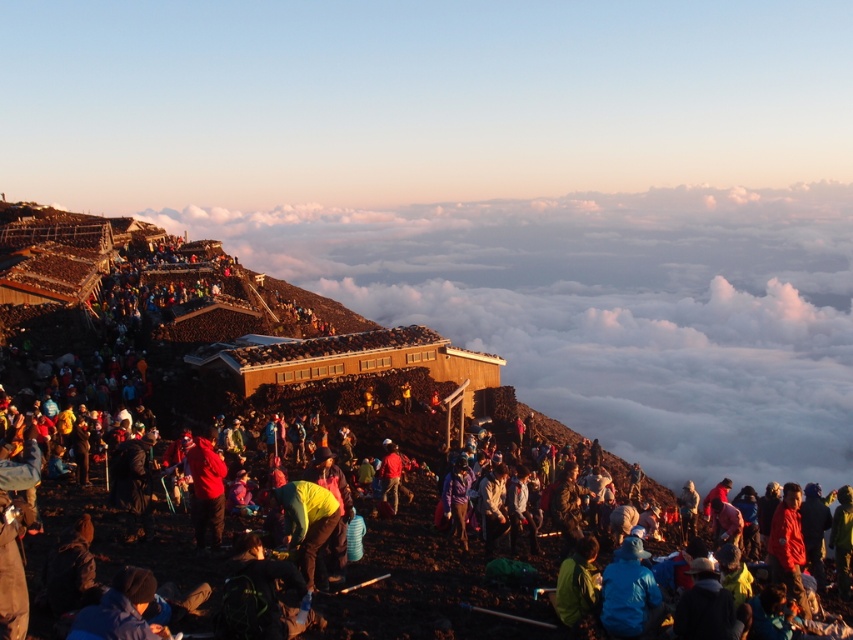
Who is lower down, yellow jacket at center or matte red jacket at center?

Positioned lower is matte red jacket at center.

Who is more distant from viewer, (241, 513) or (212, 464)?

The point (241, 513) is more distant.

Between point (166, 378) and point (192, 522), which one is positioned behind?

Point (166, 378)

At what (x,y) coordinates should I click in order to perform the action: click on yellow jacket at center. Please return your answer as a coordinate pair (x, y). Looking at the image, I should click on (251, 372).

Is yellow fabric at center wider than matte red jacket at center?

In fact, yellow fabric at center might be narrower than matte red jacket at center.

Does yellow fabric at center appear under matte red jacket at center?

Yes.

Locate an element on the screen. yellow fabric at center is located at coordinates (306, 522).

Is yellow jacket at center thinner than yellow fabric at center?

In fact, yellow jacket at center might be wider than yellow fabric at center.

Does yellow jacket at center appear on the right side of yellow fabric at center?

No, yellow jacket at center is not to the right of yellow fabric at center.

You are a GUI agent. You are given a task and a screenshot of the screen. Output one action in this format:
    pyautogui.click(x=<x>, y=<y>)
    Task: Click on the yellow jacket at center
    The height and width of the screenshot is (640, 853).
    Given the screenshot: What is the action you would take?
    pyautogui.click(x=251, y=372)